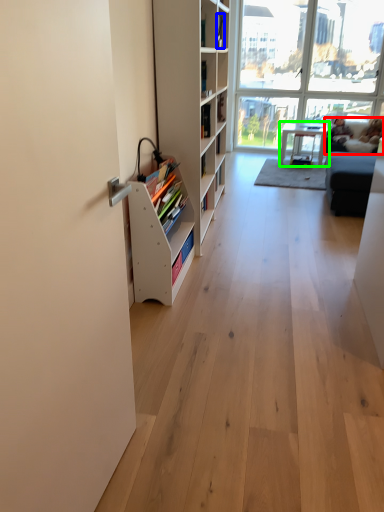
Question: Estimate the real-world distances between objects in this image. Which object is closer to couch (highlighted by a red box), book (highlighted by a blue box) or table (highlighted by a green box)?

Choices:
 (A) book
 (B) table

Answer: (B)